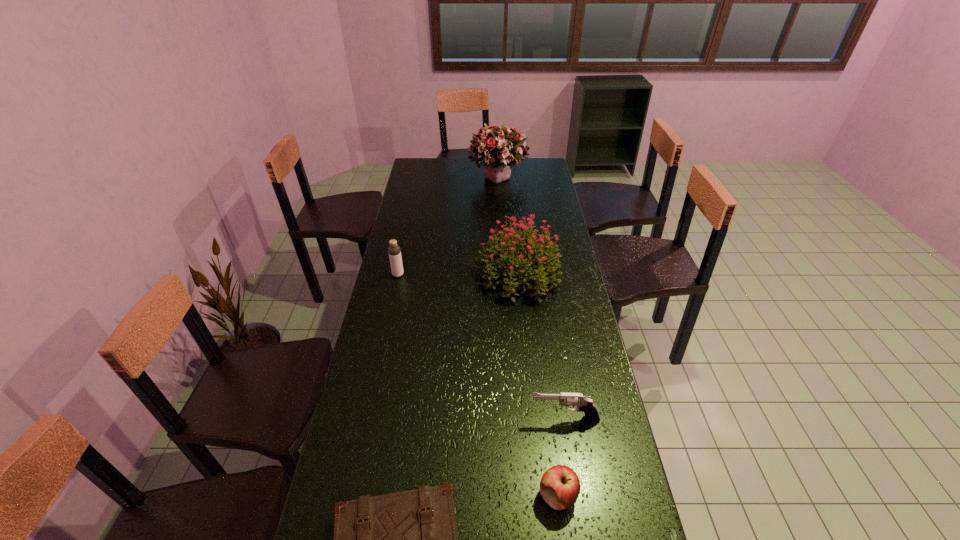
Image resolution: width=960 pixels, height=540 pixels. In the image, there is a desktop. Identify the location of vacant space at the right edge. (548, 295).

In the image, there is a desktop. At what (x,y) coordinates should I click in order to perform the action: click on free space at the far left corner. Please return your answer as a coordinate pair (x, y). The image size is (960, 540). Looking at the image, I should click on (418, 159).

Find the location of a particular element. This screenshot has height=540, width=960. unoccupied area between the farthest object and the nearer bouquet is located at coordinates (508, 227).

Where is `free space between the nearer bouquet and the gun`? This screenshot has height=540, width=960. free space between the nearer bouquet and the gun is located at coordinates (541, 347).

Locate an element on the screen. vacant point located between the farthest object and the nearer bouquet is located at coordinates (508, 227).

This screenshot has width=960, height=540. In order to click on unoccupied position between the nearer bouquet and the fifth tallest object in this screenshot , I will do `click(539, 386)`.

Where is `vacant point located between the third tallest object and the nearer bouquet`? vacant point located between the third tallest object and the nearer bouquet is located at coordinates (458, 275).

At what (x,y) coordinates should I click in order to perform the action: click on free spot between the farther bouquet and the apple. Please return your answer as a coordinate pair (x, y). The image size is (960, 540). Looking at the image, I should click on (528, 337).

Locate an element on the screen. This screenshot has width=960, height=540. object that is the second closest to the farther bouquet is located at coordinates (394, 251).

You are a GUI agent. You are given a task and a screenshot of the screen. Output one action in this format:
    pyautogui.click(x=<x>, y=<y>)
    Task: Click on the object identified as the fifth closest to the farthest object
    This screenshot has height=540, width=960.
    Given the screenshot: What is the action you would take?
    pyautogui.click(x=408, y=539)